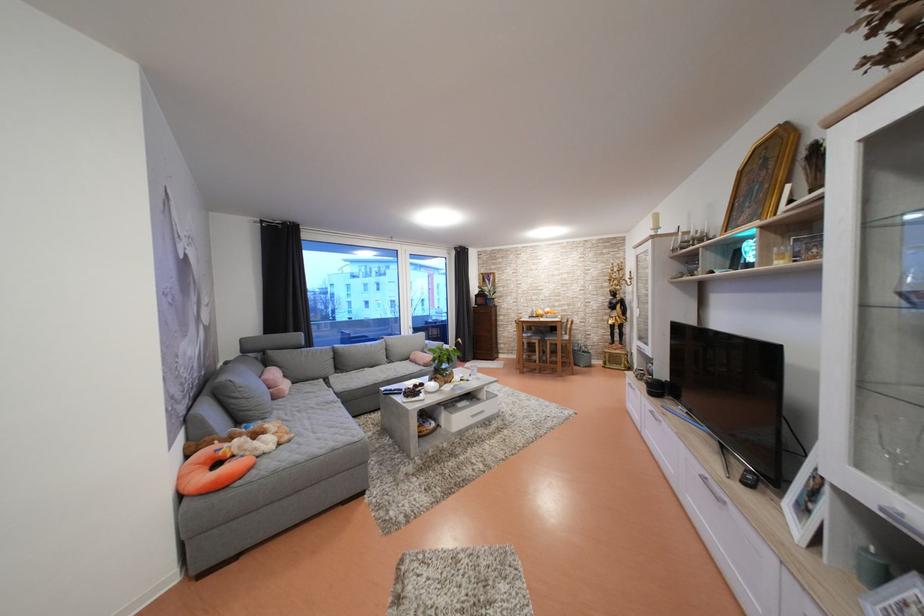
Find the location of a particular element. The width and height of the screenshot is (924, 616). small drinking glass is located at coordinates (472, 370).